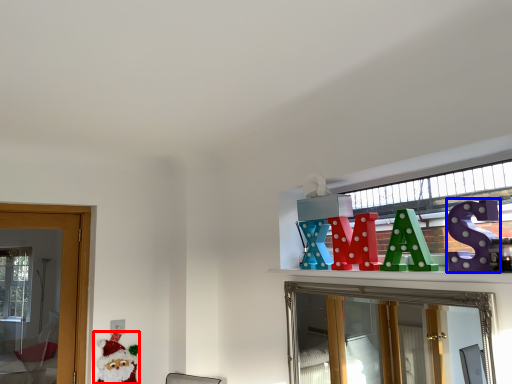
Question: Which point is further to the camera, santa claus (highlighted by a red box) or toy (highlighted by a blue box)?

Choices:
 (A) santa claus
 (B) toy

Answer: (A)